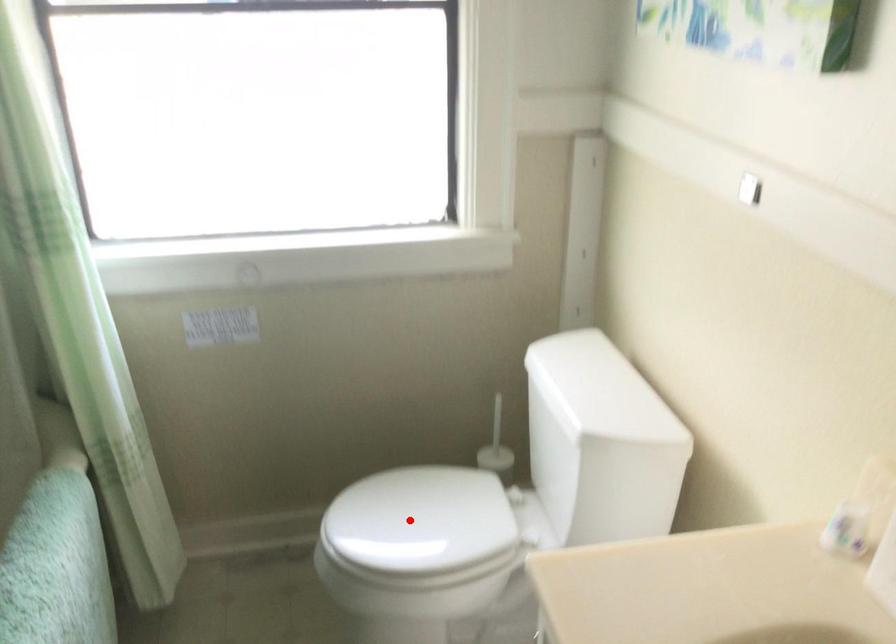
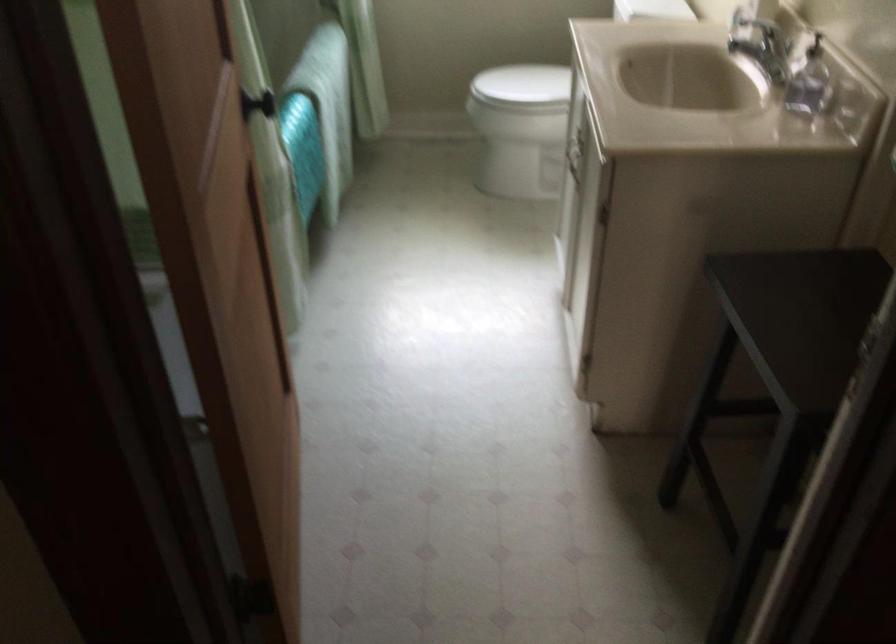
The point at the highlighted location is marked in the first image. Where is the corresponding point in the second image?

(522, 84)